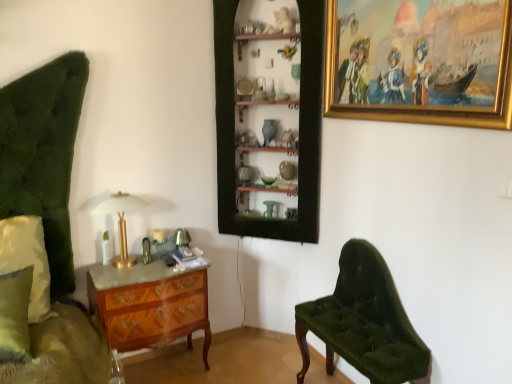
At what (x,y) coordinates should I click in order to perform the action: click on gold metallic table lamp at center. Please return your answer as a coordinate pair (x, y). The width and height of the screenshot is (512, 384). Looking at the image, I should click on (121, 221).

This screenshot has width=512, height=384. What do you see at coordinates (364, 321) in the screenshot?
I see `velvet green bench at lower right` at bounding box center [364, 321].

This screenshot has width=512, height=384. In order to click on gold metallic table lamp at center in this screenshot , I will do `click(121, 221)`.

Between velvet green bench at lower right and gold-framed painting at upper right, which one has smaller width?

gold-framed painting at upper right is thinner.

Can we say velvet green bench at lower right lies outside gold-framed painting at upper right?

Absolutely, velvet green bench at lower right is external to gold-framed painting at upper right.

Identify the location of picture frame above the velvet green bench at lower right (from a real-world perspective). Image resolution: width=512 pixels, height=384 pixels. (420, 62).

Would you consider velvet green bench at lower right to be distant from gold-framed painting at upper right?

velvet green bench at lower right is near gold-framed painting at upper right, not far away.

In the scene shown: Which of these two, wooden marquetry chest of drawers at lower left or velvet green bench at lower right, is wider?

Wider between the two is wooden marquetry chest of drawers at lower left.

Considering the relative positions of wooden marquetry chest of drawers at lower left and velvet green bench at lower right in the image provided, is wooden marquetry chest of drawers at lower left to the left of velvet green bench at lower right from the viewer's perspective?

Yes, wooden marquetry chest of drawers at lower left is to the left of velvet green bench at lower right.

Is wooden marquetry chest of drawers at lower left oriented away from velvet green bench at lower right?

No, wooden marquetry chest of drawers at lower left is not facing away from velvet green bench at lower right.

From the image's perspective, is wooden marquetry chest of drawers at lower left located above or below velvet green bench at lower right?

wooden marquetry chest of drawers at lower left is situated lower than velvet green bench at lower right in the image.

Looking at this image, measure the distance between gold-framed painting at upper right and gold metallic table lamp at center.

gold-framed painting at upper right and gold metallic table lamp at center are 5.11 feet apart from each other.

Is gold-framed painting at upper right behind gold metallic table lamp at center?

No, gold-framed painting at upper right is closer to the viewer.

Based on the photo, can you confirm if gold-framed painting at upper right is positioned to the right of gold metallic table lamp at center?

Indeed, gold-framed painting at upper right is positioned on the right side of gold metallic table lamp at center.

Are gold-framed painting at upper right and gold metallic table lamp at center making contact?

No, gold-framed painting at upper right is not with gold metallic table lamp at center.

Is wooden shelves at center positioned with its back to velvet green bench at lower right?

No, wooden shelves at center's orientation is not away from velvet green bench at lower right.

Looking at the image, does wooden shelves at center seem bigger or smaller compared to velvet green bench at lower right?

wooden shelves at center is bigger than velvet green bench at lower right.

Consider the image. Considering the positions of objects wooden shelves at center and velvet green bench at lower right in the image provided, who is more to the right, wooden shelves at center or velvet green bench at lower right?

Positioned to the right is velvet green bench at lower right.

From a real-world perspective, who is located lower, wooden shelves at center or velvet green bench at lower right?

velvet green bench at lower right.

Is green fabric pillow at left at the right side of wooden shelves at center?

In fact, green fabric pillow at left is to the left of wooden shelves at center.

Consider the image. From a real-world perspective, is green fabric pillow at left under wooden shelves at center?

Yes.

Looking at this image, is green fabric pillow at left beside wooden shelves at center?

No, green fabric pillow at left is not in contact with wooden shelves at center.

Can you confirm if green fabric pillow at left is bigger than wooden shelves at center?

Actually, green fabric pillow at left might be smaller than wooden shelves at center.

Considering the positions of objects wooden marquetry chest of drawers at lower left and wooden shelves at center in the image provided, who is more to the right, wooden marquetry chest of drawers at lower left or wooden shelves at center?

Positioned to the right is wooden shelves at center.

From a real-world perspective, is wooden marquetry chest of drawers at lower left on top of wooden shelves at center?

No, from a real-world perspective, wooden marquetry chest of drawers at lower left is not above wooden shelves at center.

Could you tell me if green fabric pillow at left is turned towards velvet green bench at lower right?

No, green fabric pillow at left is not aimed at velvet green bench at lower right.

Locate an element on the screen. pillow above the velvet green bench at lower right (from the image's perspective) is located at coordinates click(27, 260).

Can velvet green bench at lower right be found inside green fabric pillow at left?

No, velvet green bench at lower right is located outside of green fabric pillow at left.

Consider the image. From a real-world perspective, is green fabric pillow at left above or below velvet green bench at lower right?

Clearly, from a real-world perspective, green fabric pillow at left is above velvet green bench at lower right.

The height and width of the screenshot is (384, 512). What are the coordinates of `chair below the gold-framed painting at upper right (from a real-world perspective)` in the screenshot? It's located at (364, 321).

Locate an element on the screen. The height and width of the screenshot is (384, 512). chest of drawers below the velvet green bench at lower right (from the image's perspective) is located at coordinates (150, 306).

Based on their spatial positions, is gold-framed painting at upper right or velvet green bench at lower right closer to gold metallic table lamp at center?

velvet green bench at lower right.

Which object lies nearer to the anchor point gold-framed painting at upper right, velvet green bench at lower right or gold metallic table lamp at center?

Among the two, velvet green bench at lower right is located nearer to gold-framed painting at upper right.

From the image, which object appears to be farther from gold metallic table lamp at center, velvet green bench at lower right or gold-framed painting at upper right?

Based on the image, gold-framed painting at upper right appears to be further to gold metallic table lamp at center.

Estimate the real-world distances between objects in this image. Which object is further from wooden marquetry chest of drawers at lower left, green fabric pillow at left or gold-framed painting at upper right?

Among the two, gold-framed painting at upper right is located further to wooden marquetry chest of drawers at lower left.

Based on the photo, considering their positions, is green fabric pillow at left positioned closer to gold metallic table lamp at center than wooden marquetry chest of drawers at lower left?

wooden marquetry chest of drawers at lower left lies closer to gold metallic table lamp at center than the other object.

Based on their spatial positions, is velvet green bench at lower right or wooden shelves at center further from wooden marquetry chest of drawers at lower left?

Among the two, velvet green bench at lower right is located further to wooden marquetry chest of drawers at lower left.

From the image, which object appears to be nearer to gold-framed painting at upper right, wooden marquetry chest of drawers at lower left or velvet green bench at lower right?

velvet green bench at lower right lies closer to gold-framed painting at upper right than the other object.

Based on their spatial positions, is velvet green bench at lower right or wooden shelves at center further from gold metallic table lamp at center?

Based on the image, velvet green bench at lower right appears to be further to gold metallic table lamp at center.

Identify the location of chest of drawers between green fabric pillow at left and velvet green bench at lower right in the horizontal direction. The height and width of the screenshot is (384, 512). (150, 306).

Locate an element on the screen. Image resolution: width=512 pixels, height=384 pixels. chair situated between gold metallic table lamp at center and gold-framed painting at upper right from left to right is located at coordinates (364, 321).

Image resolution: width=512 pixels, height=384 pixels. What are the coordinates of `the chest of drawers located between gold metallic table lamp at center and velvet green bench at lower right in the left-right direction` in the screenshot? It's located at (150, 306).

Find the location of a particular element. The width and height of the screenshot is (512, 384). table lamp situated between green fabric pillow at left and velvet green bench at lower right from left to right is located at coordinates (121, 221).